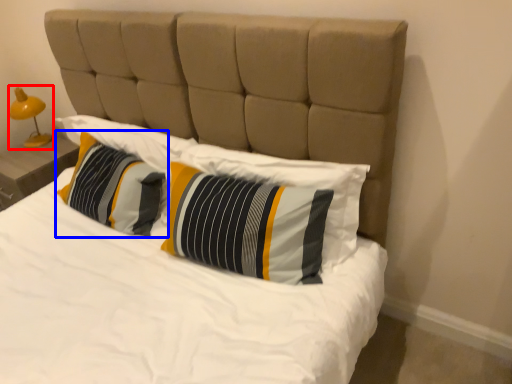
Question: Which object is further to the camera taking this photo, bedside lamp (highlighted by a red box) or pillow (highlighted by a blue box)?

Choices:
 (A) bedside lamp
 (B) pillow

Answer: (A)